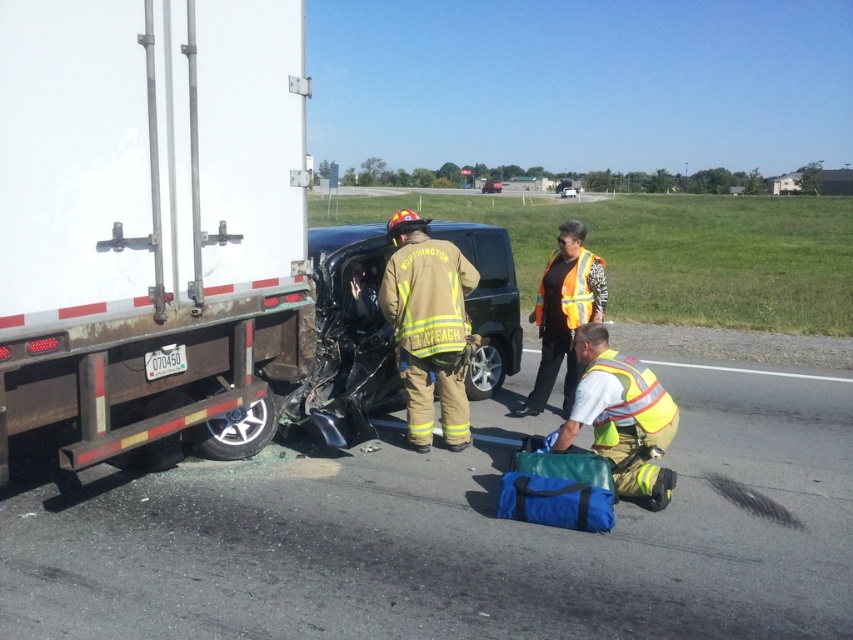
You are a firefighter arriving at the scene of an accident between a large truck and a smaller car. You need to place your reflective yellow fire gear exactly at the center of the scene. According to the coordinates provided, is the reflective yellow fire gear at center placed correctly?

The reflective yellow fire gear at center is placed at point coordinates of (428, 326), which is very close to the center point of the scene. Therefore, it is correctly positioned.

You are a traffic officer at the accident scene. You need to determine if the point of impact was within the 5 meter safety zone from the camera. Is the point of impact at point (184, 99) within the 5 meter safety zone?

The distance of point (184, 99) from camera is 4.16 meters, so yes, the point of impact is within the 5 meter safety zone.

Looking at this image, you are a firefighter assessing the scene of an accident. You see a reflective yellow fire gear at center and a black glossy car at center. How far apart are these two items from each other?

The reflective yellow fire gear at center and the black glossy car at center are 74.77 meters apart from each other.